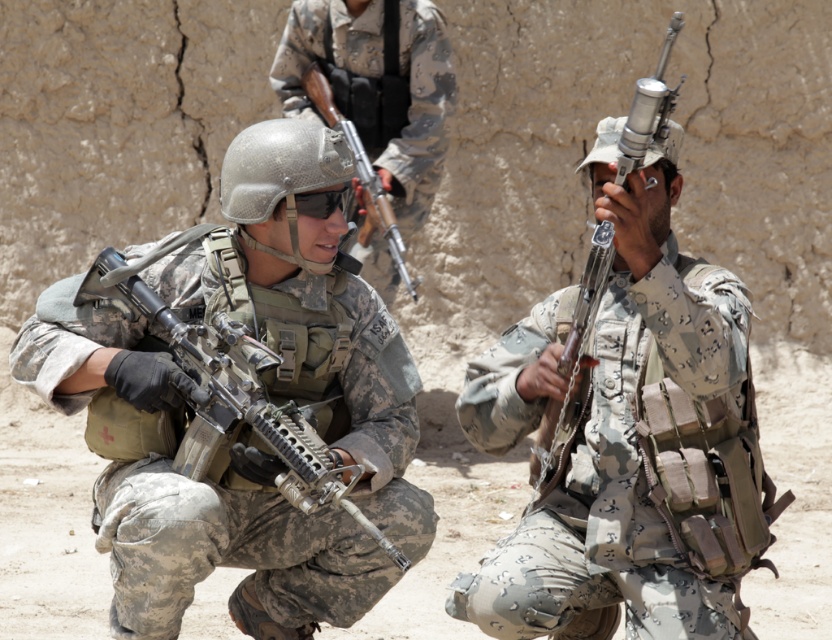
Is matte black rifle at center positioned in front of matte black rifle at left?

That is False.

Which is behind, point (364, 60) or point (359, 509)?

The point (364, 60) is behind.

Does point (358, 131) lie behind point (161, 301)?

Yes.

Where is `matte black rifle at center`? Image resolution: width=832 pixels, height=640 pixels. matte black rifle at center is located at coordinates (379, 86).

Does point (676, 276) lie in front of point (375, 44)?

That is True.

Is point (642, 371) positioned after point (354, 22)?

No.

Is point (618, 211) positioned before point (317, 16)?

Yes, it is.

Find the location of a particular element. The image size is (832, 640). camouflage fabric rifle at center is located at coordinates click(x=640, y=449).

Between camouflage uniform at center and camouflage fabric rifle at center, which one appears on the right side from the viewer's perspective?

camouflage fabric rifle at center

Is camouflage uniform at center further to camera compared to camouflage fabric rifle at center?

Yes, camouflage uniform at center is behind camouflage fabric rifle at center.

Between point (194, 348) and point (592, 433), which one is positioned in front?

Point (194, 348) is more forward.

At what (x,y) coordinates should I click in order to perform the action: click on camouflage uniform at center. Please return your answer as a coordinate pair (x, y). Looking at the image, I should click on (258, 397).